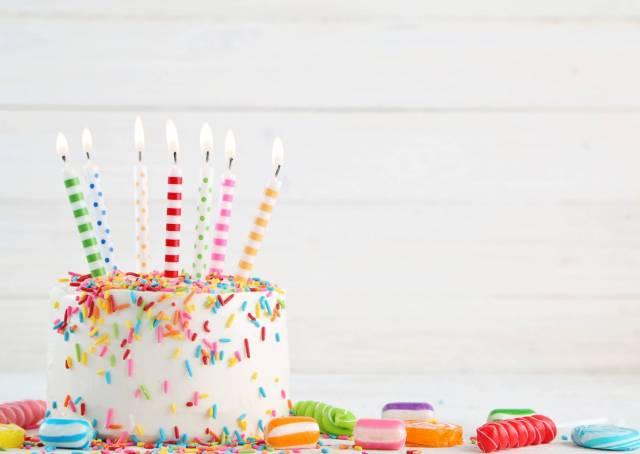
The width and height of the screenshot is (640, 454). Find the location of `birthday cake candle wicks`. birthday cake candle wicks is located at coordinates (63, 159), (86, 156), (139, 156), (176, 159), (205, 159), (228, 165), (276, 173).